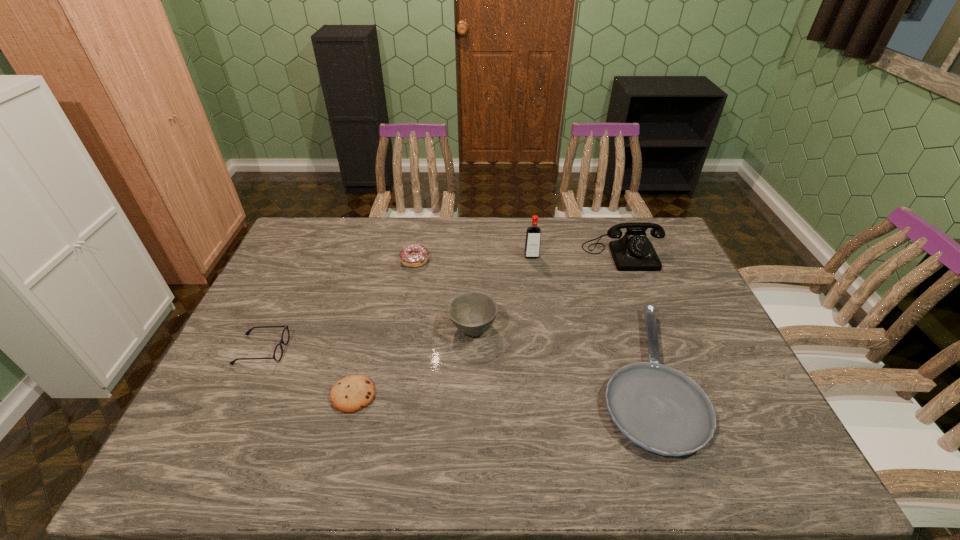
Identify the location of vacant space at the near right corner. (777, 473).

This screenshot has height=540, width=960. I want to click on vacant space in between the frying pan and the doughnut, so click(x=529, y=318).

Where is `vacant point located between the fourth object from left to right and the cookie`? This screenshot has height=540, width=960. vacant point located between the fourth object from left to right and the cookie is located at coordinates (413, 361).

At what (x,y) coordinates should I click in order to perform the action: click on empty space between the frying pan and the shortest object. Please return your answer as a coordinate pair (x, y). The width and height of the screenshot is (960, 540). Looking at the image, I should click on (498, 386).

The width and height of the screenshot is (960, 540). Find the location of `vacant space that is in between the fourth object from right to left and the doughnut`. vacant space that is in between the fourth object from right to left and the doughnut is located at coordinates (444, 294).

The image size is (960, 540). What are the coordinates of `vacant point located between the third tallest object and the shortest object` in the screenshot? It's located at (413, 361).

Find the location of a particular element. vacant space in between the third tallest object and the cookie is located at coordinates pyautogui.click(x=413, y=361).

Identify the location of free space that is in between the vodka and the cookie. This screenshot has height=540, width=960. (443, 326).

This screenshot has width=960, height=540. Find the location of `free space between the tallest object and the doughnut`. free space between the tallest object and the doughnut is located at coordinates (473, 259).

Where is `free space that is in between the shortest object and the bowl`? This screenshot has height=540, width=960. free space that is in between the shortest object and the bowl is located at coordinates (413, 361).